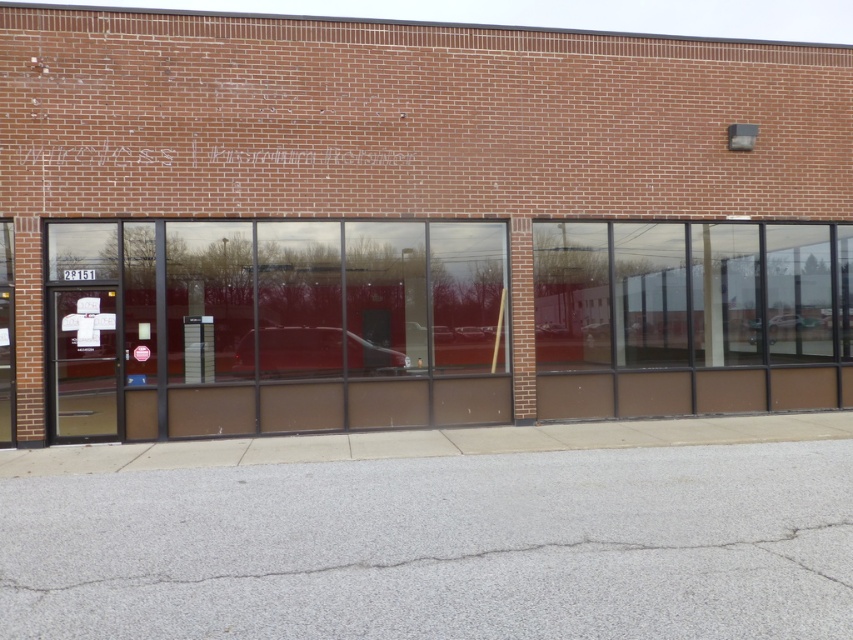
Can you confirm if brown glass storefront at center is shorter than clear glass door at left?

No, brown glass storefront at center is not shorter than clear glass door at left.

Can you confirm if brown glass storefront at center is smaller than clear glass door at left?

Incorrect, brown glass storefront at center is not smaller in size than clear glass door at left.

You are a GUI agent. You are given a task and a screenshot of the screen. Output one action in this format:
    pyautogui.click(x=<x>, y=<y>)
    Task: Click on the brown glass storefront at center
    The width and height of the screenshot is (853, 640).
    Given the screenshot: What is the action you would take?
    pyautogui.click(x=421, y=220)